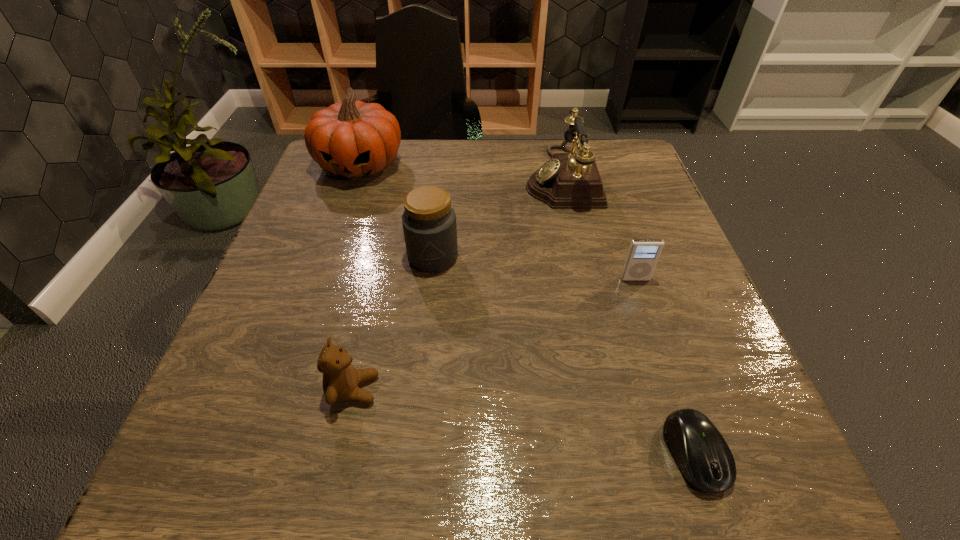
This screenshot has height=540, width=960. In order to click on empty space that is in between the shortest object and the pumpkin in this screenshot , I will do `click(527, 309)`.

The width and height of the screenshot is (960, 540). In order to click on free spot between the pumpkin and the telephone in this screenshot , I will do tap(461, 171).

Where is `free point between the telephone and the mouse`? free point between the telephone and the mouse is located at coordinates (628, 315).

Locate which object is the second closest to the mouse. Please provide its 2D coordinates. Your answer should be formatted as a tuple, i.e. [(x, y)], where the tuple contains the x and y coordinates of a point satisfying the conditions above.

[(340, 381)]

Select which object appears as the closest to the shortest object. Please provide its 2D coordinates. Your answer should be formatted as a tuple, i.e. [(x, y)], where the tuple contains the x and y coordinates of a point satisfying the conditions above.

[(643, 254)]

Where is `vacant space that satisfies the following two spatial constraints: 1. on the surface of the third object from left to right near the warning symbol; 2. on the right side of the mouse`? The image size is (960, 540). vacant space that satisfies the following two spatial constraints: 1. on the surface of the third object from left to right near the warning symbol; 2. on the right side of the mouse is located at coordinates (412, 454).

Find the location of a particular element. Image resolution: width=960 pixels, height=540 pixels. free space that satisfies the following two spatial constraints: 1. on the dial of the shortest object; 2. on the right side of the telephone is located at coordinates (624, 454).

I want to click on free location that satisfies the following two spatial constraints: 1. on the face of the mouse; 2. on the left side of the pumpkin, so click(260, 454).

You are a GUI agent. You are given a task and a screenshot of the screen. Output one action in this format:
    pyautogui.click(x=<x>, y=<y>)
    Task: Click on the vacant region that satisfies the following two spatial constraints: 1. on the surface of the fourth object from right to left near the warning symbol; 2. on the front-facing side of the teddy bear
    The width and height of the screenshot is (960, 540).
    Given the screenshot: What is the action you would take?
    pyautogui.click(x=419, y=389)

Locate an element on the screen. free space that satisfies the following two spatial constraints: 1. on the front-facing side of the teddy bear; 2. on the back side of the shortest object is located at coordinates (340, 454).